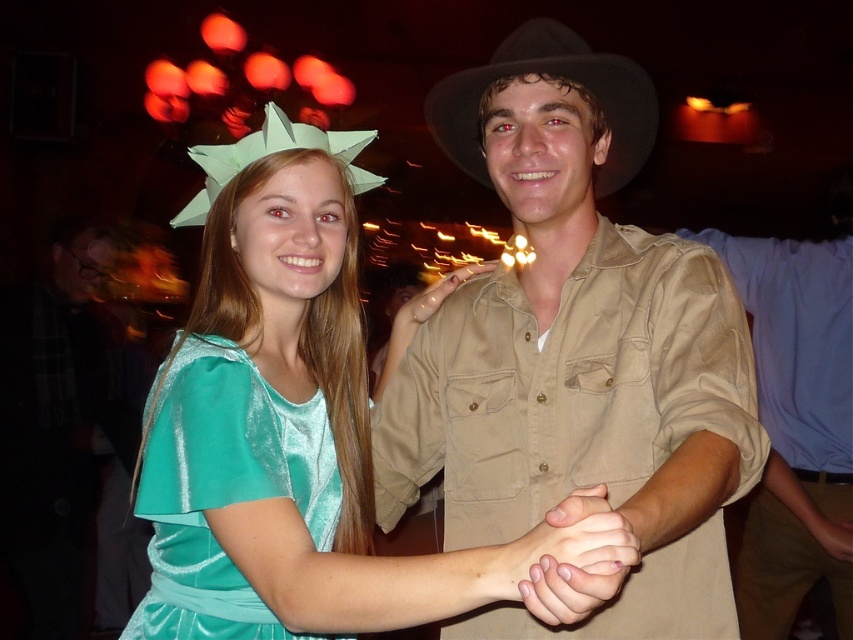
You are a photographer at the event and want to capture a photo of the satin tan shirt at center. Based on its position, where should you aim your camera?

The satin tan shirt at center is located at point 0.561 on the x axis and 0.676 on the y axis, so you should aim your camera towards those coordinates to capture it.